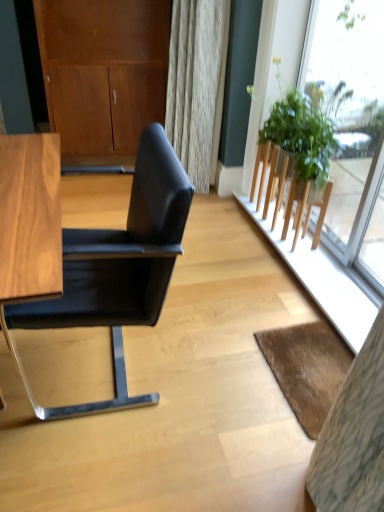
Locate an element on the screen. This screenshot has width=384, height=512. free area in between black leather chair at left and brown textured mat at lower right is located at coordinates (206, 390).